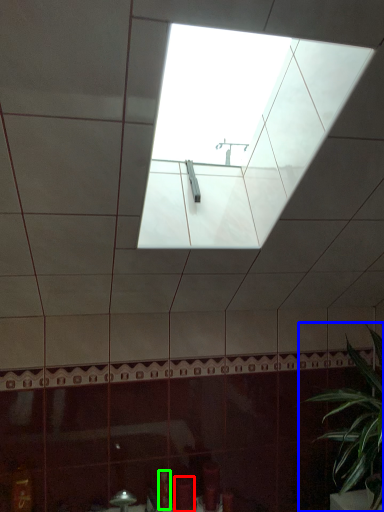
Question: Estimate the real-world distances between objects in this image. Which object is closer to toiletry (highlighted by a red box), houseplant (highlighted by a blue box) or toiletry (highlighted by a green box)?

Choices:
 (A) houseplant
 (B) toiletry

Answer: (B)